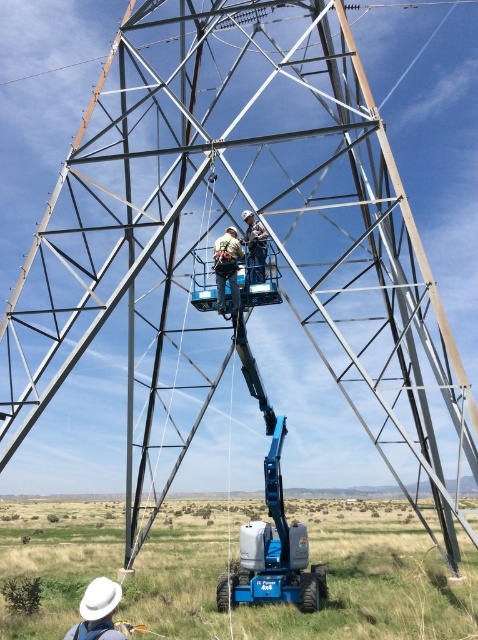
Question: Can you confirm if white fabric hat at lower left is wider than light brown fabric safety harness at center?

Choices:
 (A) yes
 (B) no

Answer: (B)

Question: Which object is positioned closest to the metallic safety harness at center?

Choices:
 (A) white fabric hat at lower left
 (B) blue rubberized bucket truck at lower center

Answer: (A)

Question: Does blue metallic boom lift at lower center have a larger size compared to metallic safety harness at center?

Choices:
 (A) yes
 (B) no

Answer: (B)

Question: From the image, what is the correct spatial relationship of blue metallic boom lift at lower center in relation to white fabric hat at lower left?

Choices:
 (A) above
 (B) below

Answer: (A)

Question: Considering the real-world distances, which object is farthest from the blue metallic boom lift at lower center?

Choices:
 (A) white fabric hat at lower left
 (B) blue rubberized bucket truck at lower center
 (C) metallic safety harness at center

Answer: (B)

Question: Which point appears farthest from the camera in this image?

Choices:
 (A) (116, 608)
 (B) (260, 257)

Answer: (B)